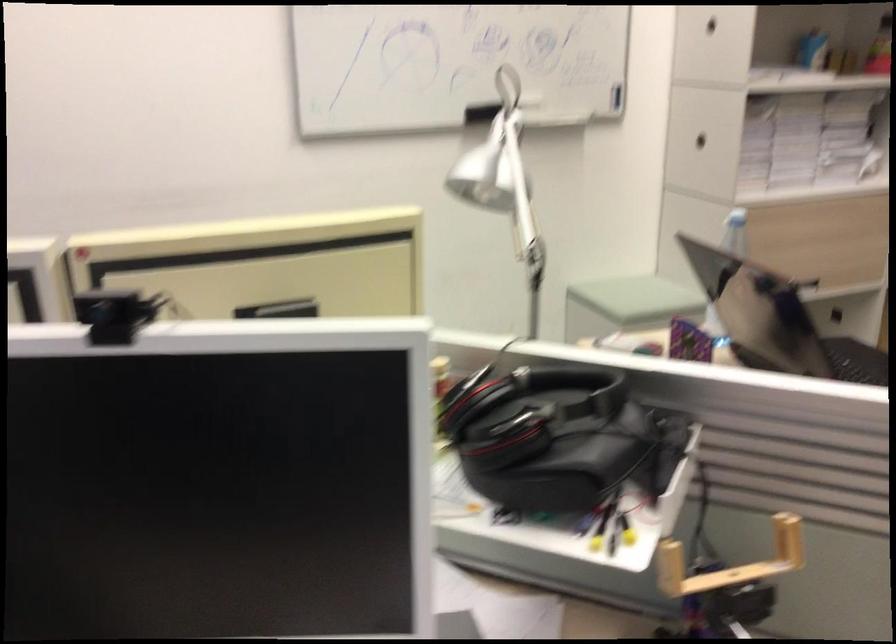
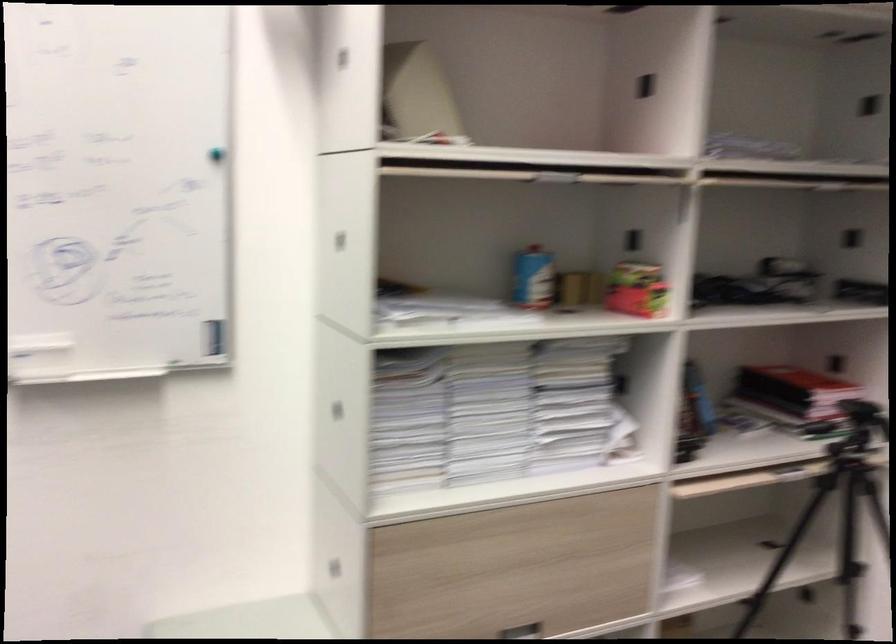
Locate, in the second image, the point that corresponds to pixel 519 100 in the first image.

(33, 350)